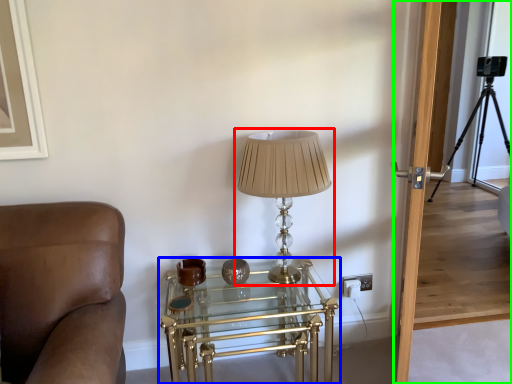
Question: Which object is the farthest from lamp (highlighted by a red box)? Choose among these: table (highlighted by a blue box) or glass door (highlighted by a green box).

Choices:
 (A) table
 (B) glass door

Answer: (A)